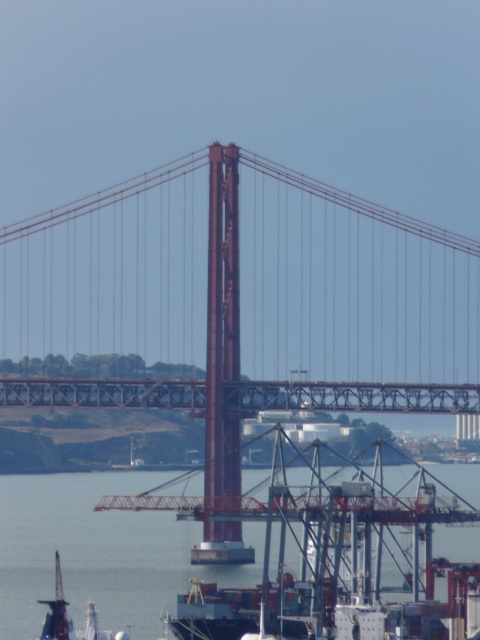
Question: Does red metal suspension bridge at center come behind gray metallic water at lower center?

Choices:
 (A) no
 (B) yes

Answer: (A)

Question: Does red metal suspension bridge at center have a greater width compared to gray metallic water at lower center?

Choices:
 (A) yes
 (B) no

Answer: (B)

Question: Is red metal suspension bridge at center wider than gray metallic water at lower center?

Choices:
 (A) yes
 (B) no

Answer: (B)